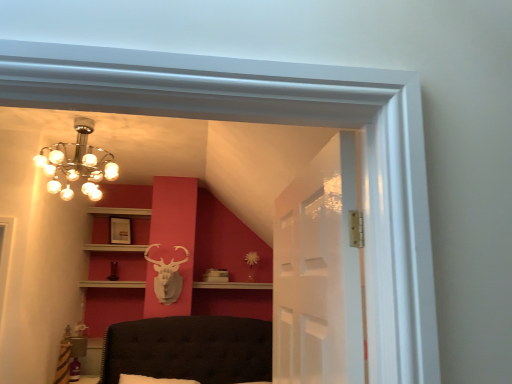
Question: Can you confirm if white wood shelf at upper center is shorter than matte white picture frame at upper center?

Choices:
 (A) yes
 (B) no

Answer: (A)

Question: Is matte white picture frame at upper center at the back of white wood shelf at upper center?

Choices:
 (A) yes
 (B) no

Answer: (B)

Question: Is white wood shelf at upper center in contact with matte white picture frame at upper center?

Choices:
 (A) no
 (B) yes

Answer: (A)

Question: Is white wood shelf at upper center bigger than matte white picture frame at upper center?

Choices:
 (A) yes
 (B) no

Answer: (A)

Question: Does white wood shelf at upper center have a greater height compared to matte white picture frame at upper center?

Choices:
 (A) yes
 (B) no

Answer: (B)

Question: From the image's perspective, is transparent glass door at center above or below white matte deer head at center?

Choices:
 (A) below
 (B) above

Answer: (B)

Question: In terms of size, does transparent glass door at center appear bigger or smaller than white matte deer head at center?

Choices:
 (A) small
 (B) big

Answer: (B)

Question: Looking at their shapes, would you say transparent glass door at center is wider or thinner than white matte deer head at center?

Choices:
 (A) wide
 (B) thin

Answer: (B)

Question: Is point [x=323, y=148] positioned closer to the camera than point [x=161, y=269]?

Choices:
 (A) farther
 (B) closer

Answer: (B)

Question: Considering the positions of chrome/metallic chandelier at upper left and matte white picture frame at upper center in the image, is chrome/metallic chandelier at upper left taller or shorter than matte white picture frame at upper center?

Choices:
 (A) short
 (B) tall

Answer: (B)

Question: Looking at their shapes, would you say chrome/metallic chandelier at upper left is wider or thinner than matte white picture frame at upper center?

Choices:
 (A) wide
 (B) thin

Answer: (A)

Question: Considering the positions of chrome/metallic chandelier at upper left and matte white picture frame at upper center in the image, is chrome/metallic chandelier at upper left bigger or smaller than matte white picture frame at upper center?

Choices:
 (A) small
 (B) big

Answer: (B)

Question: Is chrome/metallic chandelier at upper left to the left or to the right of matte white picture frame at upper center in the image?

Choices:
 (A) left
 (B) right

Answer: (B)

Question: Is matte white picture frame at upper center to the left or to the right of white wood shelf at upper center in the image?

Choices:
 (A) right
 (B) left

Answer: (A)

Question: Is matte white picture frame at upper center spatially inside white wood shelf at upper center, or outside of it?

Choices:
 (A) inside
 (B) outside

Answer: (B)